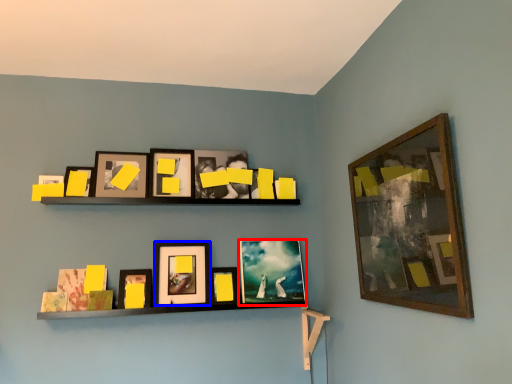
Question: Which point is further to the camera, picture frame (highlighted by a red box) or picture frame (highlighted by a blue box)?

Choices:
 (A) picture frame
 (B) picture frame

Answer: (A)